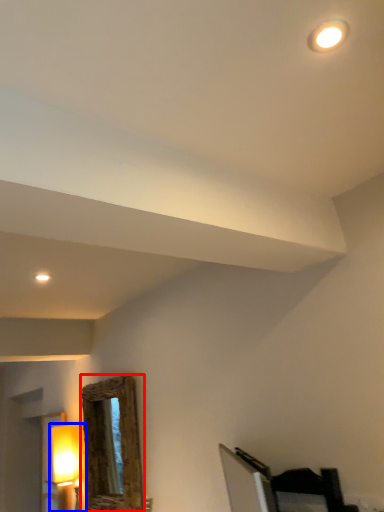
Question: Which point is closer to the camera, mirror (highlighted by a red box) or lamp (highlighted by a blue box)?

Choices:
 (A) mirror
 (B) lamp

Answer: (A)